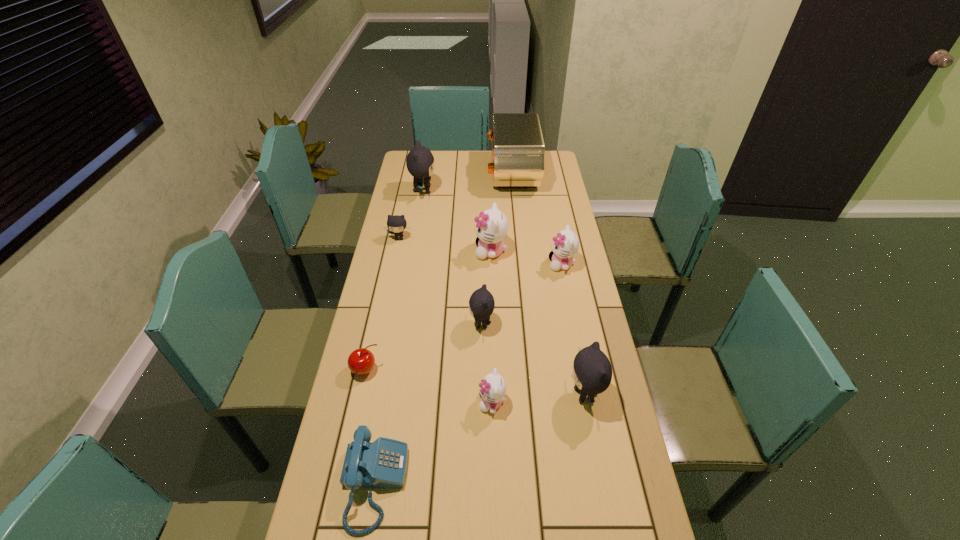
At what (x,y) coordinates should I click in order to perform the action: click on free location located 0.320m on the front-facing side of the smallest white kitten. Please return your answer as a coordinate pair (x, y). The width and height of the screenshot is (960, 540). Looking at the image, I should click on (365, 402).

Find the location of a particular element. The height and width of the screenshot is (540, 960). vacant space situated 0.260m on the front-facing side of the smallest white kitten is located at coordinates (x=386, y=402).

At what (x,y) coordinates should I click in order to perform the action: click on free location located on the front-facing side of the smallest white kitten. Please return your answer as a coordinate pair (x, y). The image size is (960, 540). Looking at the image, I should click on (432, 402).

At what (x,y) coordinates should I click in order to perform the action: click on vacant space located 0.130m on the front-facing side of the third nearest gray kitten. Please return your answer as a coordinate pair (x, y). Image resolution: width=960 pixels, height=540 pixels. Looking at the image, I should click on (394, 265).

Where is `vacant space located on the right of the cherry`? Image resolution: width=960 pixels, height=540 pixels. vacant space located on the right of the cherry is located at coordinates (484, 370).

Locate an element on the screen. Image resolution: width=960 pixels, height=540 pixels. vacant region located on the dial of the blue telephone is located at coordinates pos(519,484).

You are a GUI agent. You are given a task and a screenshot of the screen. Output one action in this format:
    pyautogui.click(x=<x>, y=<y>)
    Task: Click on the object at the far edge
    This screenshot has height=540, width=960.
    Given the screenshot: What is the action you would take?
    (x=518, y=151)

This screenshot has height=540, width=960. What are the coordinates of `cherry present at the left edge` in the screenshot? It's located at (361, 361).

You are a GUI agent. You are given a task and a screenshot of the screen. Output one action in this format:
    pyautogui.click(x=<x>, y=<y>)
    Task: Click on the telephone that is at the left edge
    
    Given the screenshot: What is the action you would take?
    pyautogui.click(x=383, y=463)

Find the location of a particular element. The height and width of the screenshot is (540, 960). toaster oven present at the right edge is located at coordinates (518, 151).